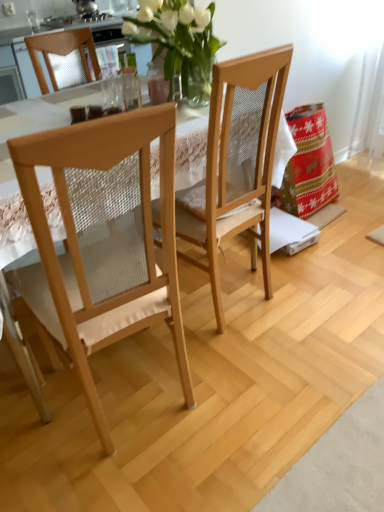
You are a GUI agent. You are given a task and a screenshot of the screen. Output one action in this format:
    pyautogui.click(x=<x>, y=<y>)
    Task: Click on the free space in front of light brown wood chair at center, which is the 2th chair from left to right
    The width and height of the screenshot is (384, 512).
    Given the screenshot: What is the action you would take?
    pyautogui.click(x=247, y=350)